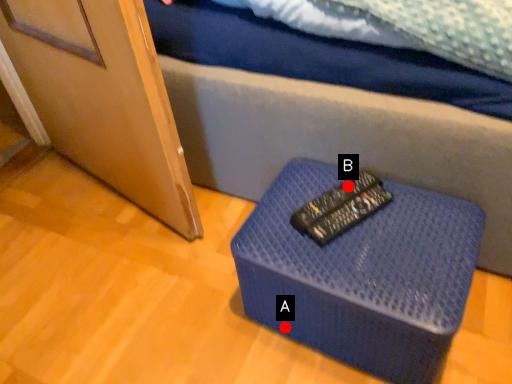
Question: Two points are circled on the image, labeled by A and B beside each circle. Which point is further to the camera?

Choices:
 (A) A is further
 (B) B is further

Answer: (A)